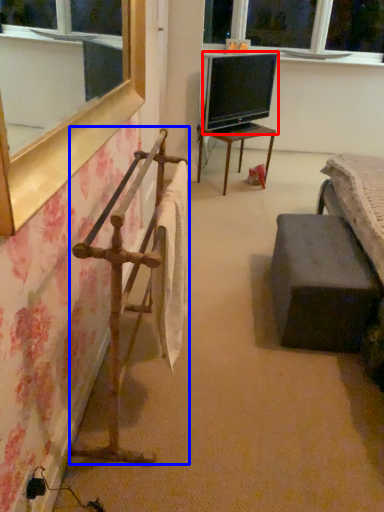
Question: Among these objects, which one is farthest to the camera, television (highlighted by a red box) or rail (highlighted by a blue box)?

Choices:
 (A) television
 (B) rail

Answer: (A)